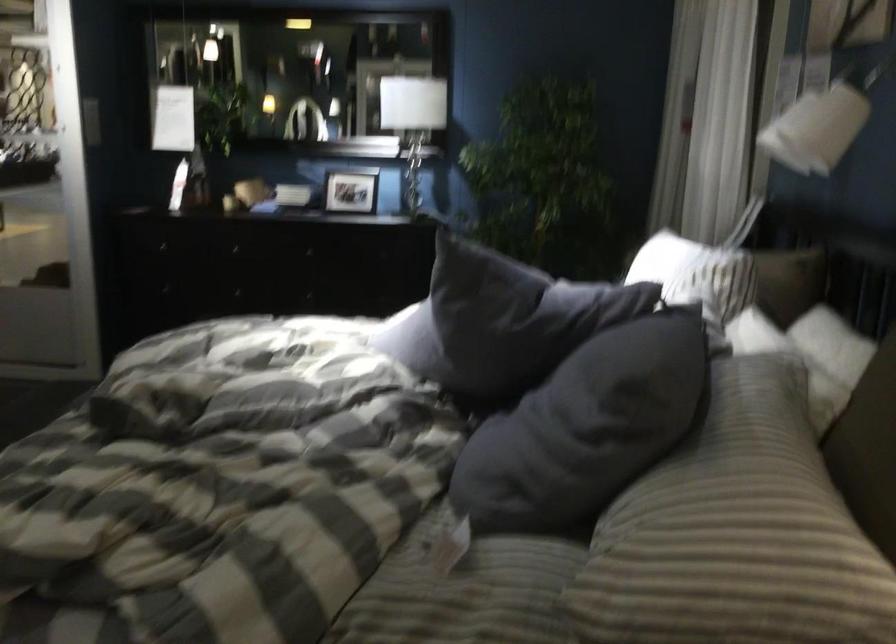
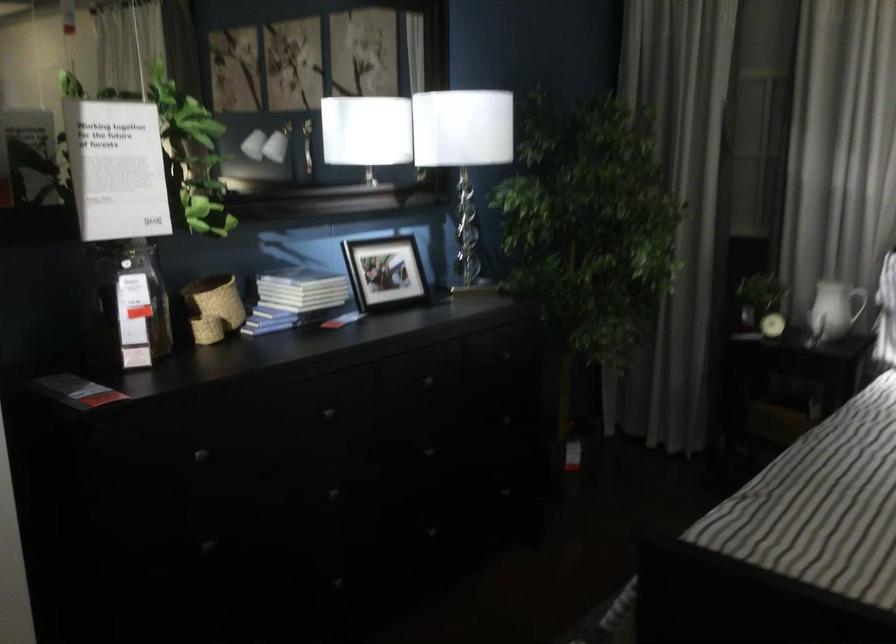
Question: I am providing you with two images of the same scene from different viewpoints. After the viewpoint changes to image2, which objects are now occluded?

Choices:
 (A) large glass jar
 (B) white book
 (C) white pitcher handle
 (D) none of these

Answer: (D)